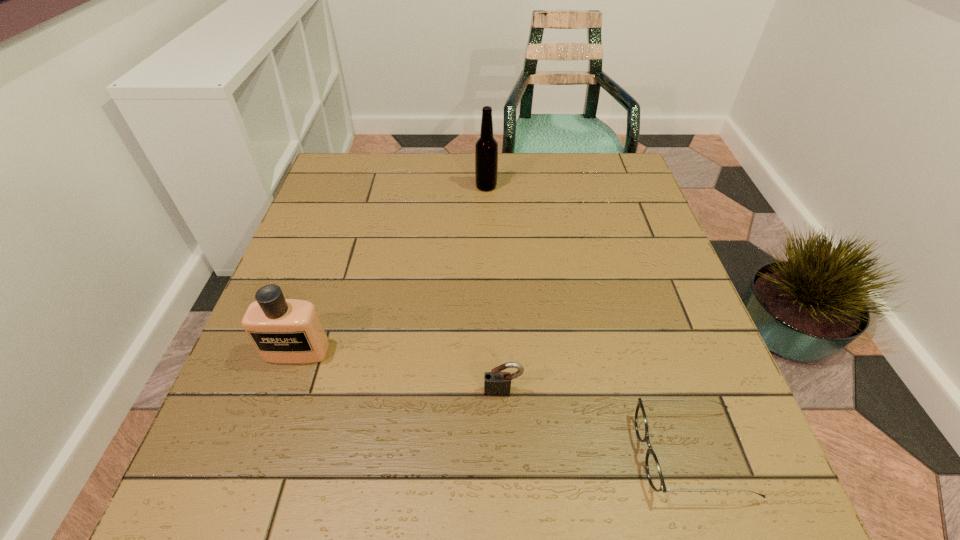
Where is `vacant point located between the nearest object and the tallest object`? This screenshot has height=540, width=960. vacant point located between the nearest object and the tallest object is located at coordinates (588, 320).

This screenshot has height=540, width=960. I want to click on unoccupied area between the perfume and the padlock, so pyautogui.click(x=399, y=370).

Locate an element on the screen. free space that is in between the leftmost object and the spectacles is located at coordinates (493, 402).

Where is `free space between the padlock and the farthest object`? free space between the padlock and the farthest object is located at coordinates (494, 288).

Find the location of a particular element. The image size is (960, 540). empty space that is in between the second shortest object and the spectacles is located at coordinates (597, 422).

Choose which object is the third nearest neighbor to the beer bottle. Please provide its 2D coordinates. Your answer should be formatted as a tuple, i.e. [(x, y)], where the tuple contains the x and y coordinates of a point satisfying the conditions above.

[(653, 469)]

I want to click on the third closest object relative to the third tallest object, so click(x=486, y=148).